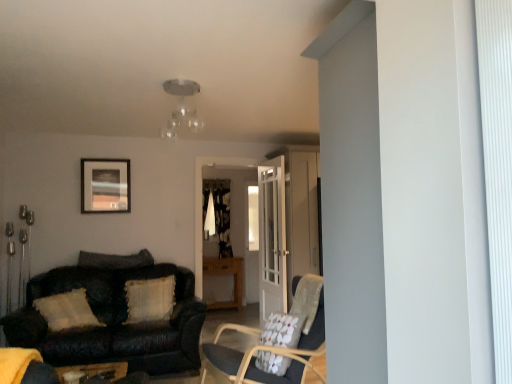
Locate an element on the screen. The width and height of the screenshot is (512, 384). matte black picture frame at upper left is located at coordinates (105, 185).

What do you see at coordinates (105, 185) in the screenshot? Image resolution: width=512 pixels, height=384 pixels. I see `matte black picture frame at upper left` at bounding box center [105, 185].

Locate an element on the screen. floral fabric chair at center is located at coordinates (272, 352).

What do you see at coordinates (272, 238) in the screenshot?
I see `white glass door at center` at bounding box center [272, 238].

In the scene shown: What is the approximate width of velvet dark gray pillow at left, which appears as the 1th pillow when viewed from the back?

It is 11.18 inches.

Describe the element at coordinates (115, 260) in the screenshot. Image resolution: width=512 pixels, height=384 pixels. I see `velvet dark gray pillow at left, the first pillow when ordered from left to right` at that location.

At what (x,y) coordinates should I click in order to perform the action: click on white textured pillow at lower right, which is counted as the 1th pillow, starting from the front. Please return your answer as a coordinate pair (x, y). Looking at the image, I should click on (283, 330).

From a real-world perspective, which is physically above, floral fabric chair at center or clear glass light fixture at upper center?

clear glass light fixture at upper center.

Is floral fabric chair at center positioned beyond the bounds of clear glass light fixture at upper center?

Yes.

Measure the distance between floral fabric chair at center and clear glass light fixture at upper center.

A distance of 1.89 meters exists between floral fabric chair at center and clear glass light fixture at upper center.

How different are the orientations of floral fabric chair at center and clear glass light fixture at upper center in degrees?

They differ by 166 degrees in their facing directions.

Considering the relative sizes of wooden table at center and floral fabric chair at center in the image provided, is wooden table at center smaller than floral fabric chair at center?

Yes.

Considering the positions of objects wooden table at center and floral fabric chair at center in the image provided, who is more to the right, wooden table at center or floral fabric chair at center?

Positioned to the right is floral fabric chair at center.

How much distance is there between wooden table at center and floral fabric chair at center?

The distance of wooden table at center from floral fabric chair at center is 3.19 meters.

Which point is more distant from viewer, (221, 266) or (269, 383)?

The point (221, 266) is farther from the camera.

Considering the positions of objects clear glass light fixture at upper center and textured beige pillow at center left, which is counted as the 2th pillow, starting from the right, in the image provided, who is in front, clear glass light fixture at upper center or textured beige pillow at center left, which is counted as the 2th pillow, starting from the right,?

clear glass light fixture at upper center.

In the scene shown: Considering the relative sizes of clear glass light fixture at upper center and textured beige pillow at center left, the second pillow positioned from the front, in the image provided, is clear glass light fixture at upper center taller than textured beige pillow at center left, the second pillow positioned from the front,?

Incorrect, the height of clear glass light fixture at upper center is not larger of that of textured beige pillow at center left, the second pillow positioned from the front.

Considering the relative sizes of clear glass light fixture at upper center and textured beige pillow at center left, which ranks as the 2th pillow in back-to-front order, in the image provided, is clear glass light fixture at upper center thinner than textured beige pillow at center left, which ranks as the 2th pillow in back-to-front order,?

No.

From a real-world perspective, is white glass door at center physically located above or below white textured pillow at lower right, placed as the first pillow when sorted from right to left?

In terms of real-world spatial position, white glass door at center is above white textured pillow at lower right, placed as the first pillow when sorted from right to left.

Between white glass door at center and white textured pillow at lower right, which is the 3th pillow in left-to-right order, which one appears on the right side from the viewer's perspective?

white textured pillow at lower right, which is the 3th pillow in left-to-right order, is more to the right.

Does white glass door at center turn towards white textured pillow at lower right, which is counted as the 1th pillow, starting from the front?

No, white glass door at center is not oriented towards white textured pillow at lower right, which is counted as the 1th pillow, starting from the front.

Who is more distant, white glass door at center or white textured pillow at lower right, which is the 3th pillow in left-to-right order?

white glass door at center is behind.

Locate an element on the screen. The height and width of the screenshot is (384, 512). chair in front of the textured beige pillow at center left, the second pillow positioned from the front is located at coordinates (272, 352).

Considering the positions of objects textured beige pillow at center left, which is the 2th pillow from left to right, and floral fabric chair at center in the image provided, who is more to the left, textured beige pillow at center left, which is the 2th pillow from left to right, or floral fabric chair at center?

textured beige pillow at center left, which is the 2th pillow from left to right.

Considering the points (157, 310) and (288, 351), which point is in front, point (157, 310) or point (288, 351)?

Positioned in front is point (288, 351).

Does textured beige pillow at center left, the second pillow positioned from the front, touch floral fabric chair at center?

textured beige pillow at center left, the second pillow positioned from the front, and floral fabric chair at center are clearly separated.

Is the depth of floral fabric chair at center less than that of white glass door at center?

Yes, floral fabric chair at center is closer to the viewer.

Considering the positions of point (303, 342) and point (271, 204), is point (303, 342) closer or farther from the camera than point (271, 204)?

Point (303, 342).

Does floral fabric chair at center touch white glass door at center?

floral fabric chair at center and white glass door at center are not in contact.

Locate an element on the screen. Image resolution: width=512 pixels, height=384 pixels. door on the right of floral fabric chair at center is located at coordinates (272, 238).

Which of these two, velvet dark gray pillow at left, the third pillow when ordered from right to left, or leather couch at left, is thinner?

Thinner between the two is velvet dark gray pillow at left, the third pillow when ordered from right to left.

Where is `the 2nd pillow behind the leather couch at left, counting from the anchor's position`? The width and height of the screenshot is (512, 384). the 2nd pillow behind the leather couch at left, counting from the anchor's position is located at coordinates (115, 260).

Which point is more forward, (79, 253) or (106, 356)?

The point (106, 356) is more forward.

I want to click on light fixture on the left side of floral fabric chair at center, so click(182, 108).

The height and width of the screenshot is (384, 512). In order to click on chair lying above the wooden table at center (from the image's perspective) in this screenshot , I will do `click(272, 352)`.

Based on the photo, based on their spatial positions, is white glass door at center or white textured pillow at lower right, the third pillow positioned from the back, closer to floral fabric chair at center?

white textured pillow at lower right, the third pillow positioned from the back.

Looking at the image, which one is located closer to velvet dark gray pillow at left, the third pillow when ordered from right to left, textured beige pillow at center left, which is counted as the 2th pillow, starting from the right, or wooden side table at lower left?

textured beige pillow at center left, which is counted as the 2th pillow, starting from the right, lies closer to velvet dark gray pillow at left, the third pillow when ordered from right to left, than the other object.

Looking at the image, which one is located further to matte black picture frame at upper left, textured beige pillow at center left, which is counted as the 2th pillow, starting from the right, or white textured pillow at lower right, the third pillow positioned from the back?

white textured pillow at lower right, the third pillow positioned from the back, is positioned further to the anchor matte black picture frame at upper left.

Estimate the real-world distances between objects in this image. Which object is closer to white glass door at center, clear glass light fixture at upper center or wooden side table at lower left?

clear glass light fixture at upper center is positioned closer to the anchor white glass door at center.

Considering their positions, is white textured pillow at lower right, which is the 3th pillow in left-to-right order, positioned closer to velvet dark gray pillow at left, the third pillow when ordered from right to left, than matte black picture frame at upper left?

matte black picture frame at upper left.

Considering their positions, is wooden side table at lower left positioned closer to matte black picture frame at upper left than wooden table at center?

Among the two, wooden side table at lower left is located nearer to matte black picture frame at upper left.

Considering their positions, is matte black picture frame at upper left positioned further to wooden table at center than white textured pillow at lower right, which is counted as the 1th pillow, starting from the front?

white textured pillow at lower right, which is counted as the 1th pillow, starting from the front.

When comparing their distances from velvet dark gray pillow at left, the first pillow when ordered from left to right, does wooden table at center or white textured pillow at lower right, which is the 3th pillow in left-to-right order, seem further?

The object further to velvet dark gray pillow at left, the first pillow when ordered from left to right, is white textured pillow at lower right, which is the 3th pillow in left-to-right order.

The width and height of the screenshot is (512, 384). I want to click on studio couch between wooden side table at lower left and textured beige pillow at center left, which is the 2th pillow from left to right, from front to back, so click(113, 320).

This screenshot has height=384, width=512. In order to click on light fixture between floral fabric chair at center and velvet dark gray pillow at left, which appears as the 1th pillow when viewed from the back, in the front-back direction in this screenshot , I will do `click(182, 108)`.

Identify the location of pillow between textured beige pillow at center left, which ranks as the 2th pillow in back-to-front order, and wooden table at center in the front-back direction. (115, 260).

Locate an element on the screen. The width and height of the screenshot is (512, 384). door located between floral fabric chair at center and matte black picture frame at upper left in the depth direction is located at coordinates (272, 238).